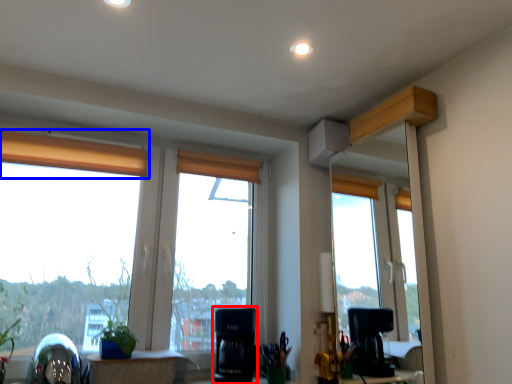
Question: Which object appears farthest to the camera in this image, appliance (highlighted by a red box) or curtain (highlighted by a blue box)?

Choices:
 (A) appliance
 (B) curtain

Answer: (B)